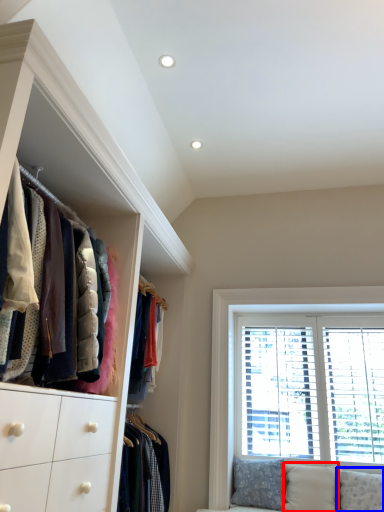
Question: Which object appears closest to the camera in this image, pillow (highlighted by a red box) or pillow (highlighted by a blue box)?

Choices:
 (A) pillow
 (B) pillow

Answer: (B)